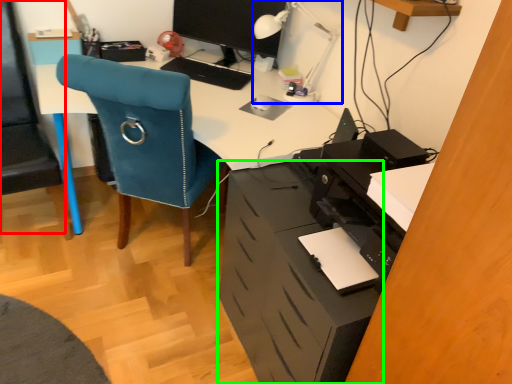
Question: Based on their relative distances, which object is farther from computer chair (highlighted by a red box)? Choose from table lamp (highlighted by a blue box) and file cabinet (highlighted by a green box).

Choices:
 (A) table lamp
 (B) file cabinet

Answer: (A)